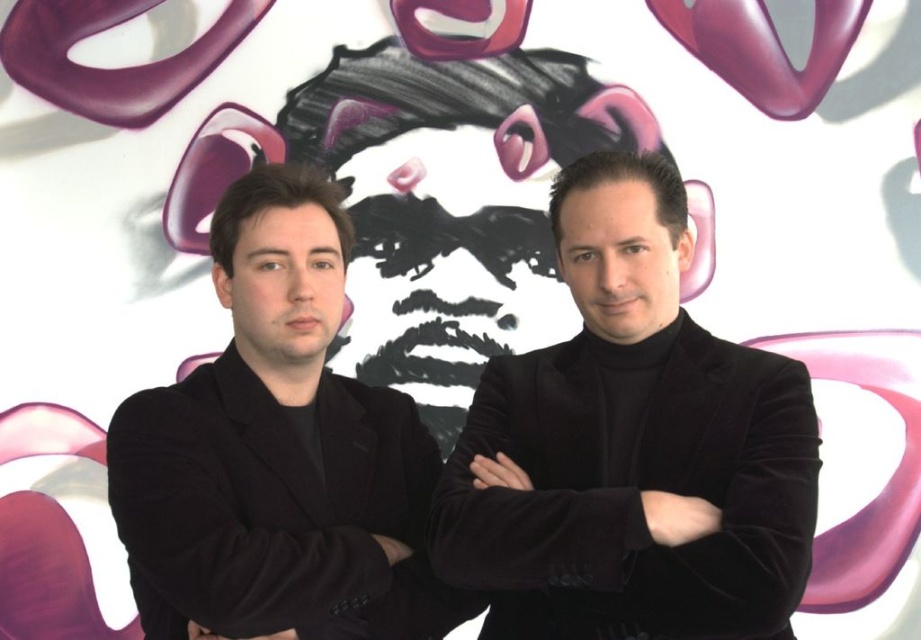
Question: Which of the following is the farthest from the observer?

Choices:
 (A) black velvet suit at center
 (B) black velvet arm at left

Answer: (B)

Question: Which object is closer to the camera taking this photo?

Choices:
 (A) black velvet suit at center
 (B) black velvet arm at left
 (C) velvet black suit at center
 (D) black velvet arm at center

Answer: (C)

Question: Which is farther from the black velvet arm at left?

Choices:
 (A) black velvet suit at center
 (B) velvet black suit at center
 (C) black velvet arm at center

Answer: (B)

Question: Is black velvet arm at left positioned before black velvet arm at center?

Choices:
 (A) yes
 (B) no

Answer: (A)

Question: Is black velvet suit at center smaller than black velvet arm at left?

Choices:
 (A) yes
 (B) no

Answer: (B)

Question: Does black velvet suit at center have a lesser width compared to black velvet arm at center?

Choices:
 (A) no
 (B) yes

Answer: (A)